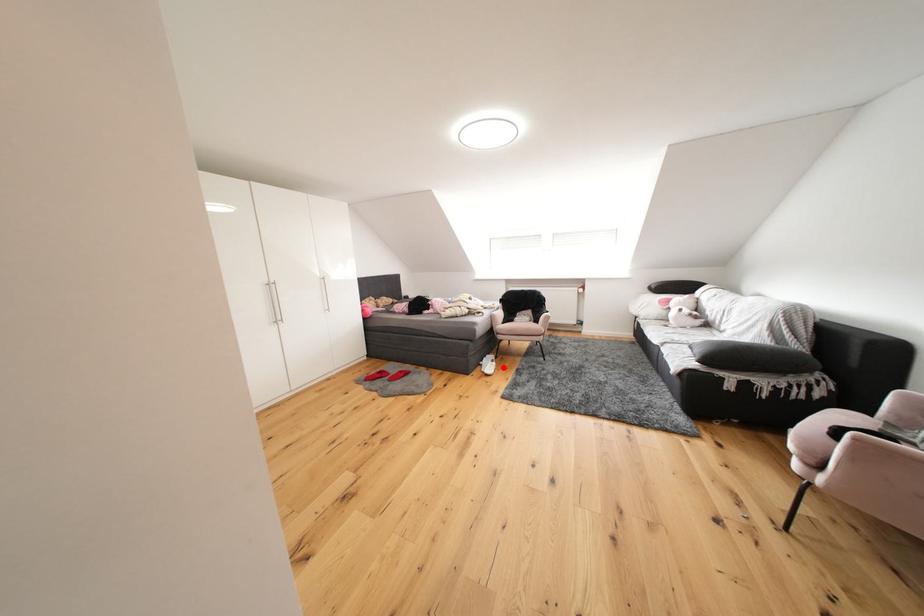
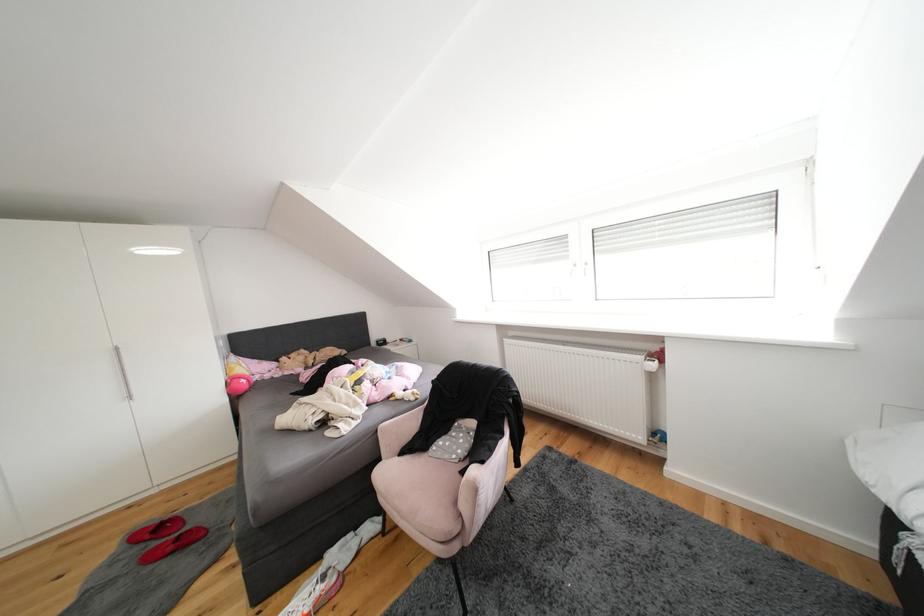
Find the pixel in the second image that matches the highlighted location in the first image.

(331, 592)